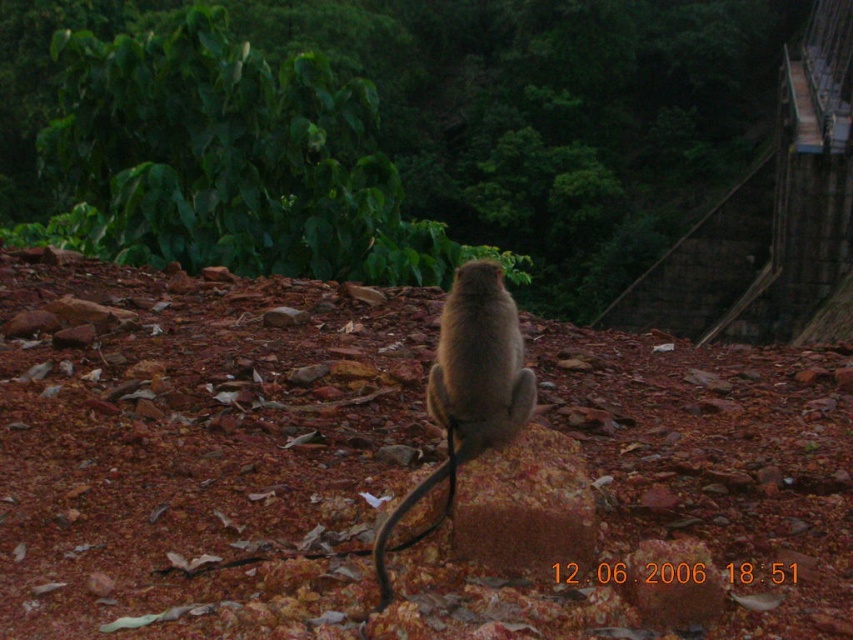
You are standing at the point marked by the coordinates point (553, 115) in the image. Looking around, what do you see immediately in front of you?

The point (553, 115) corresponds to a green leafy tree at upper center, so you would see the trunk and branches of the green leafy tree at upper center directly in front of you.

You are a hiker trying to navigate through the forest. You see the green leafy tree at upper center and the furry brown monkey at center. Which object is positioned higher in the image?

The green leafy tree at upper center is located above the furry brown monkey at center, so it is positioned higher in the image.

You are a hiker who wants to take a photo of the furry brown monkey at center and the green leafy tree at upper center in the same frame. Given that your camera has a maximum zoom range of 100 feet, can you capture both in one shot without moving your position?

The green leafy tree at upper center and furry brown monkey at center are 174.12 feet apart. Since the camera can only zoom up to 100 feet, you cannot capture both in one shot without moving your position.